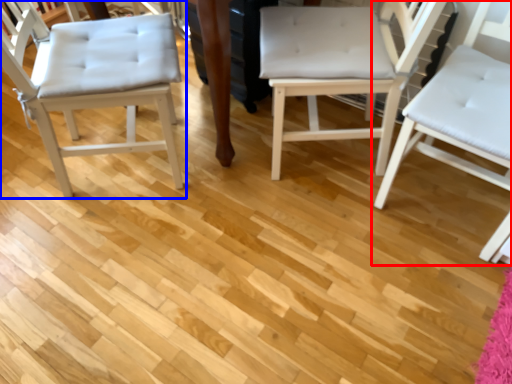
Question: Which object is further to the camera taking this photo, chair (highlighted by a red box) or chair (highlighted by a blue box)?

Choices:
 (A) chair
 (B) chair

Answer: (B)